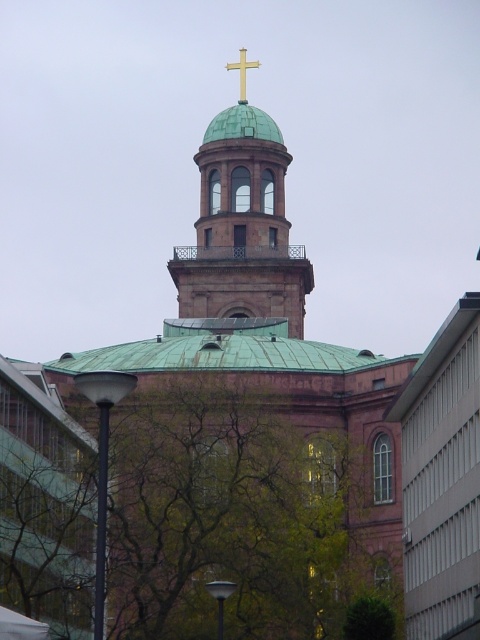
You are standing at the base of the green leafy tree at center and want to walk directly to the green copper dome at upper center. How many steps would you need to take if each step covers 0.75 meters?

The distance between the green leafy tree at center and the green copper dome at upper center is 36.31 meters. Dividing this by the step length of 0.75 meters gives approximately 48.41 steps. Since you can only take whole steps, you would need to take 49 steps to reach the green copper dome at upper center.

You are standing in front of the church and want to take a photo that includes both the green leafy tree at center and the gold metallic cross at upper center. Which object will appear bigger in the photo?

The green leafy tree at center will appear bigger in the photo because it has a larger size compared to the gold metallic cross at upper center.

You are standing in front of the church and notice the green leafy tree at center and the green copper dome at upper center. Which object is closer to you?

The green leafy tree at center is closer to you because it is in front of the green copper dome at upper center.